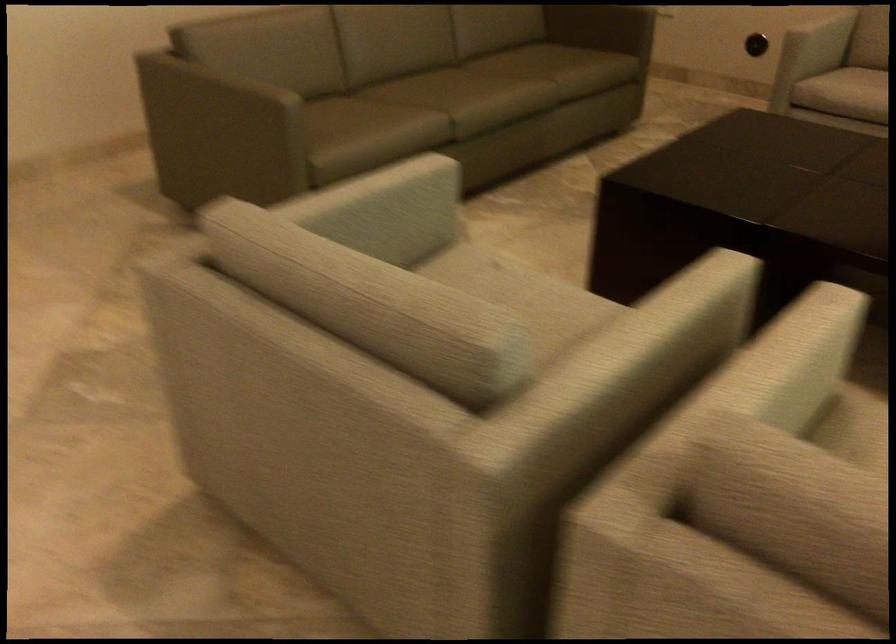
Find where to resting arm the sofa armrest. Please return your answer as a coordinate pair (x, y).

(659, 332)